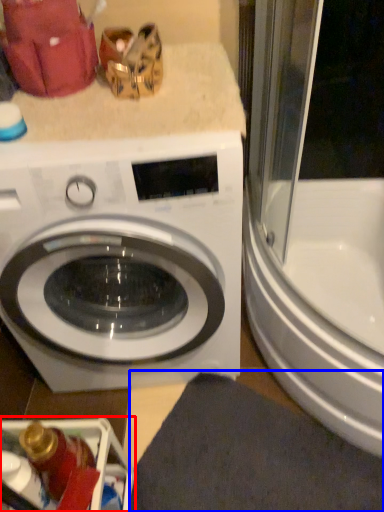
Question: Which point is further to the camera, dish washer (highlighted by a red box) or bath mat (highlighted by a blue box)?

Choices:
 (A) dish washer
 (B) bath mat

Answer: (B)